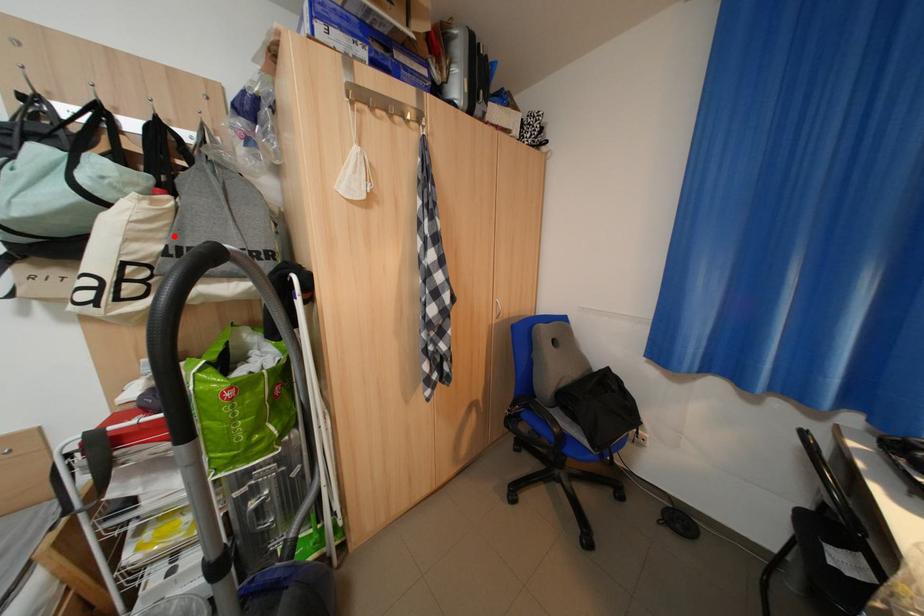
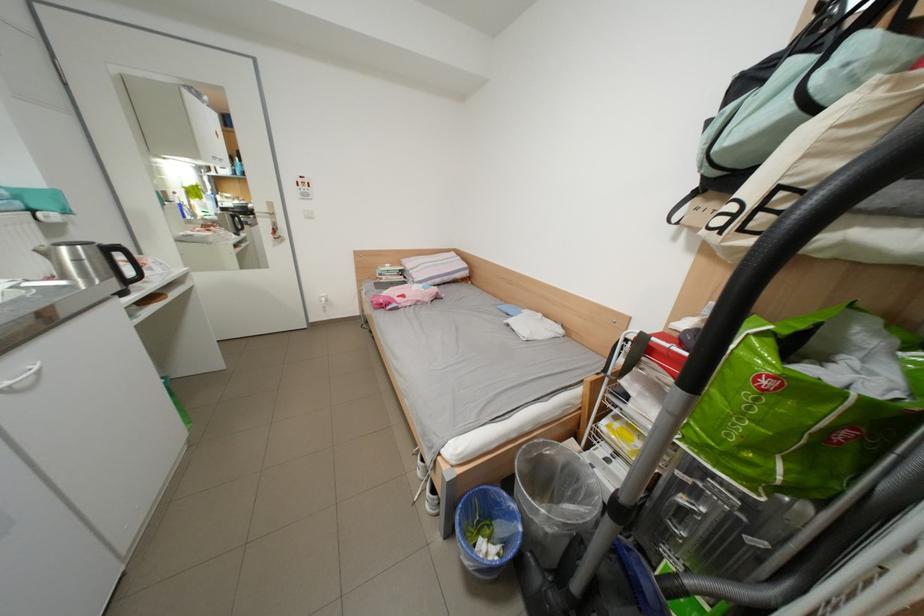
Where in the second image is the point corresponding to the highlighted location from the first image?

(877, 146)